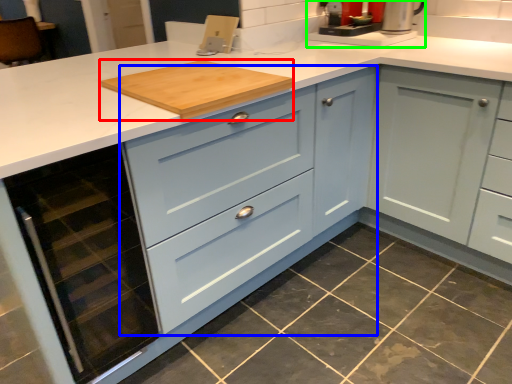
Question: Which object is the closest to the cutting board (highlighted by a red box)? Choose among these: cabinetry (highlighted by a blue box) or coffee machine (highlighted by a green box).

Choices:
 (A) cabinetry
 (B) coffee machine

Answer: (A)